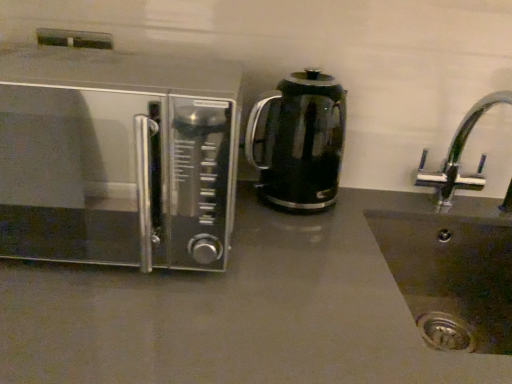
You are a GUI agent. You are given a task and a screenshot of the screen. Output one action in this format:
    pyautogui.click(x=<x>, y=<y>)
    Task: Click on the vacant area located to the right-hand side of satin silver microwave at left
    This screenshot has height=384, width=512.
    Given the screenshot: What is the action you would take?
    pyautogui.click(x=313, y=274)